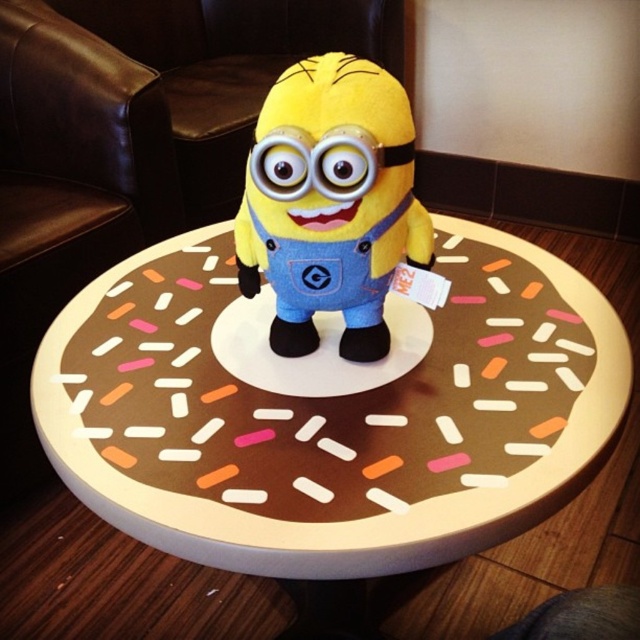
Is point (490, 518) positioned behind point (298, 134)?

That is False.

Which is more to the left, brownsprinkleddonut at center or yellow plush toy at center?

brownsprinkleddonut at center

At what (x,y) coordinates should I click in order to perform the action: click on brownsprinkleddonut at center. Please return your answer as a coordinate pair (x, y). This screenshot has height=640, width=640. Looking at the image, I should click on [330, 410].